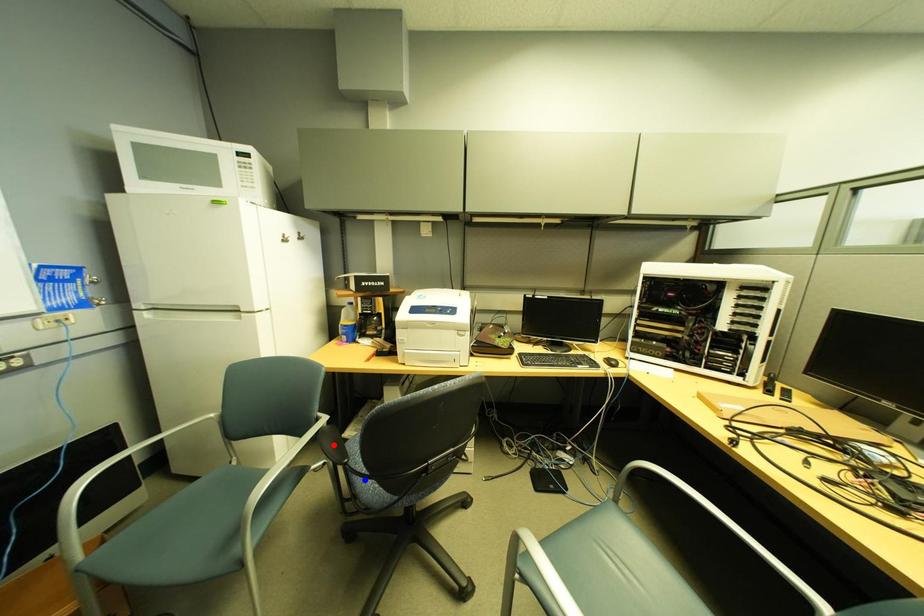
Question: In the image, two points are highlighted. Which point is nearer to the camera? Reply with the corresponding letter.

Choices:
 (A) blue point
 (B) red point

Answer: (A)